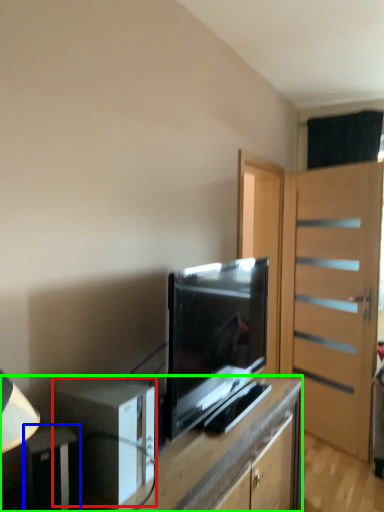
Question: Which object is positioned farthest from appliance (highlighted by a red box)? Select from appliance (highlighted by a blue box) and desk (highlighted by a green box).

Choices:
 (A) appliance
 (B) desk

Answer: (B)